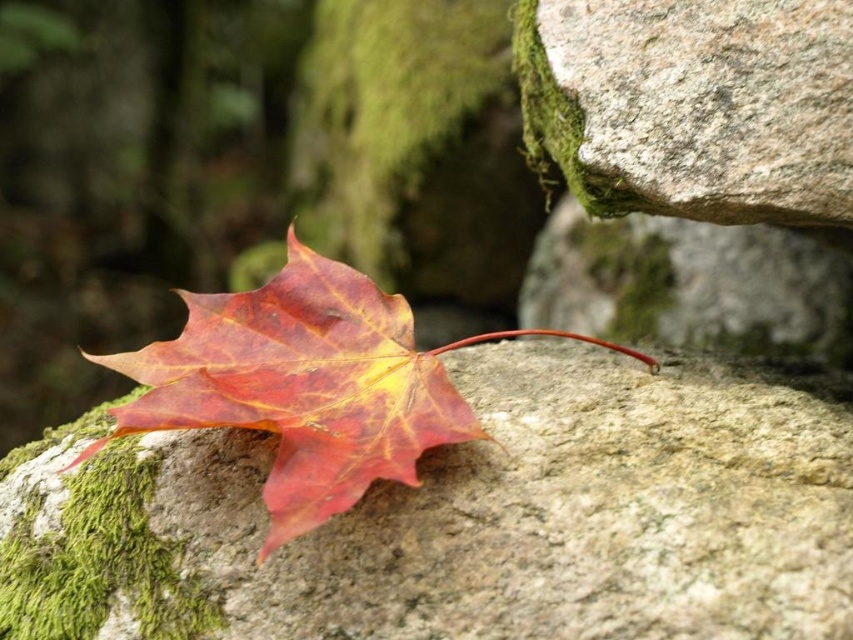
Question: Which point is farther to the camera?

Choices:
 (A) (573, 310)
 (B) (212, 316)

Answer: (A)

Question: Is shiny red maple leaf at center smaller than granite rock at upper right?

Choices:
 (A) no
 (B) yes

Answer: (B)

Question: Is shiny red maple leaf at center above granite rock at upper right?

Choices:
 (A) yes
 (B) no

Answer: (B)

Question: Which point is farther to the camera?

Choices:
 (A) (402, 468)
 (B) (834, 291)

Answer: (B)

Question: Does shiny red maple leaf at center have a greater width compared to granite rock at upper right?

Choices:
 (A) yes
 (B) no

Answer: (B)

Question: Which point is closer to the camera?

Choices:
 (A) (740, 298)
 (B) (323, 371)

Answer: (B)